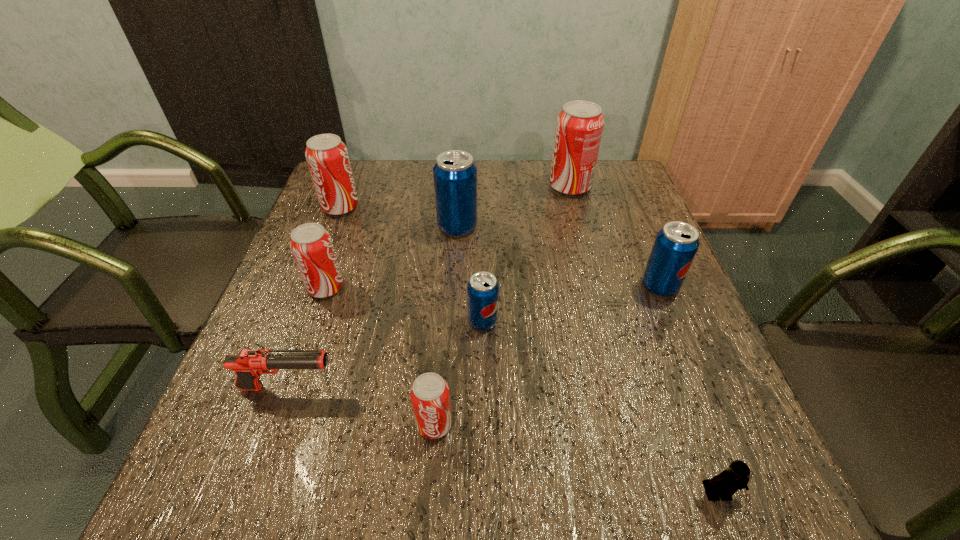
Identify which red soda can is the nearest to the third smallest red soda can. Please provide its 2D coordinates. Your answer should be formatted as a tuple, i.e. [(x, y)], where the tuple contains the x and y coordinates of a point satisfying the conditions above.

[(311, 245)]

Locate which red soda can ranks second in proximity to the tallest object. Please provide its 2D coordinates. Your answer should be formatted as a tuple, i.e. [(x, y)], where the tuple contains the x and y coordinates of a point satisfying the conditions above.

[(311, 245)]

Locate which blue pop soda ranks second in proximity to the biggest blue pop soda. Please provide its 2D coordinates. Your answer should be formatted as a tuple, i.e. [(x, y)], where the tuple contains the x and y coordinates of a point satisfying the conditions above.

[(675, 246)]

Identify which blue pop soda is the second closest to the second biggest blue pop soda. Please provide its 2D coordinates. Your answer should be formatted as a tuple, i.e. [(x, y)], where the tuple contains the x and y coordinates of a point satisfying the conditions above.

[(455, 174)]

The height and width of the screenshot is (540, 960). Find the location of `vacant space that satisfies the following two spatial constraints: 1. on the logo side of the biggest blue pop soda; 2. on the left side of the second biggest red soda can`. vacant space that satisfies the following two spatial constraints: 1. on the logo side of the biggest blue pop soda; 2. on the left side of the second biggest red soda can is located at coordinates (333, 226).

Identify the location of free space that satisfies the following two spatial constraints: 1. on the logo side of the third object from right to left; 2. on the right side of the rightmost blue pop soda. (596, 286).

Identify the location of vacant area in the image that satisfies the following two spatial constraints: 1. on the logo side of the third smallest red soda can; 2. on the right side of the second nearest blue pop soda. This screenshot has width=960, height=540. (310, 286).

At what (x,y) coordinates should I click in order to perform the action: click on free space that satisfies the following two spatial constraints: 1. on the logo side of the rightmost blue pop soda; 2. on the right side of the seventh object from left to right. Please return your answer as a coordinate pair (x, y). The width and height of the screenshot is (960, 540). Looking at the image, I should click on (596, 286).